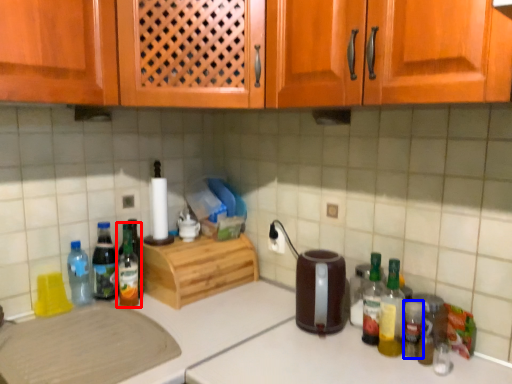
Question: Which object appears farthest to the camera in this image, bottle (highlighted by a red box) or bottle (highlighted by a blue box)?

Choices:
 (A) bottle
 (B) bottle

Answer: (A)